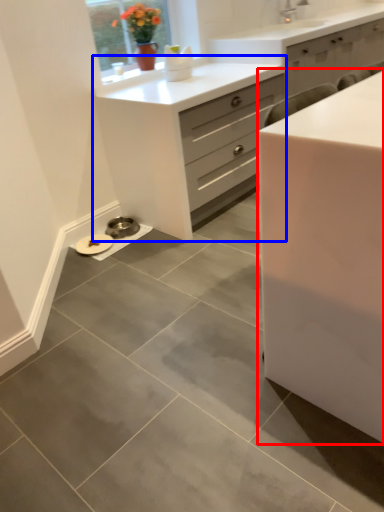
Question: Which object is closer to the camera taking this photo, chest of drawers (highlighted by a red box) or chest of drawers (highlighted by a blue box)?

Choices:
 (A) chest of drawers
 (B) chest of drawers

Answer: (A)